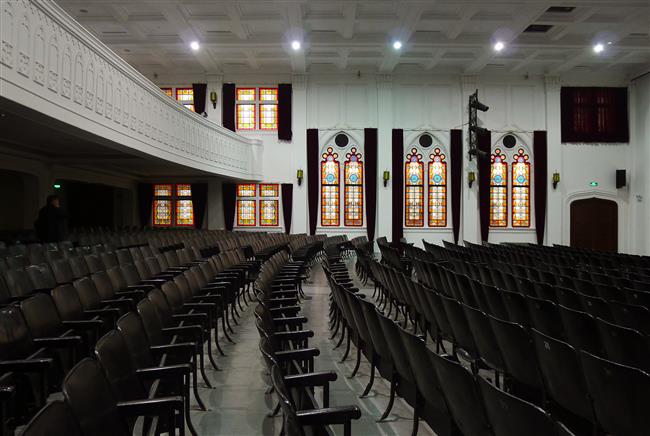
Locate an element on the screen. This screenshot has width=650, height=436. doorway is located at coordinates (592, 222).